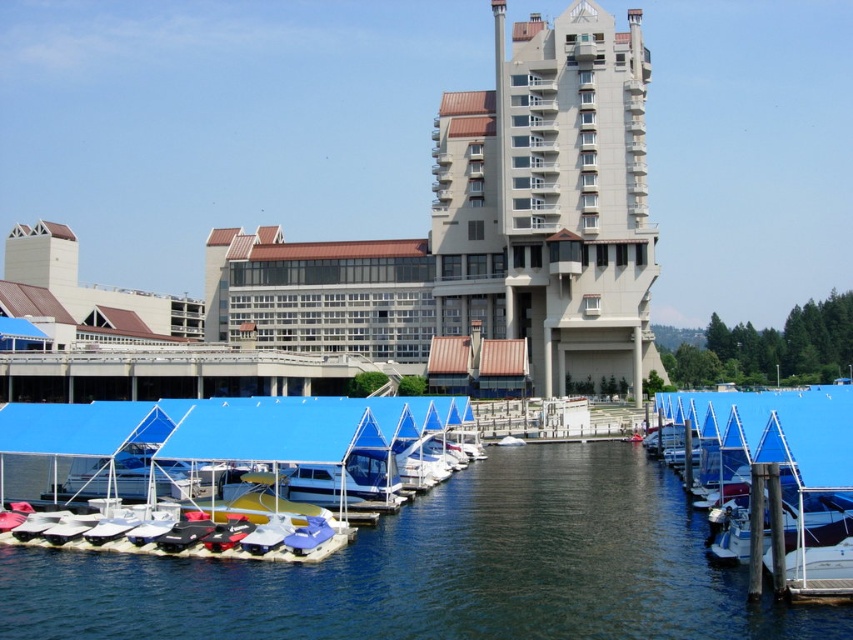
Between beige concrete building at center and blue tarpaulin boat at center, which one appears on the right side from the viewer's perspective?

From the viewer's perspective, blue tarpaulin boat at center appears more on the right side.

How far apart are beige concrete building at center and blue tarpaulin boat at center?

beige concrete building at center is 30.53 meters from blue tarpaulin boat at center.

Find the location of a particular element. Image resolution: width=853 pixels, height=640 pixels. beige concrete building at center is located at coordinates (550, 200).

The width and height of the screenshot is (853, 640). Identify the location of blue water at center. (440, 570).

Looking at this image, between blue water at center and beige concrete building at center, which one has less height?

With less height is blue water at center.

Identify the location of blue water at center. (440, 570).

At what (x,y) coordinates should I click in order to perform the action: click on blue water at center. Please return your answer as a coordinate pair (x, y). Image resolution: width=853 pixels, height=640 pixels. Looking at the image, I should click on (440, 570).

Between beige concrete building at center and blue tarp-covered boats at center, which one is positioned lower?

blue tarp-covered boats at center is lower down.

Can you confirm if beige concrete building at center is smaller than blue tarp-covered boats at center?

Actually, beige concrete building at center might be larger than blue tarp-covered boats at center.

I want to click on beige concrete building at center, so pos(550,200).